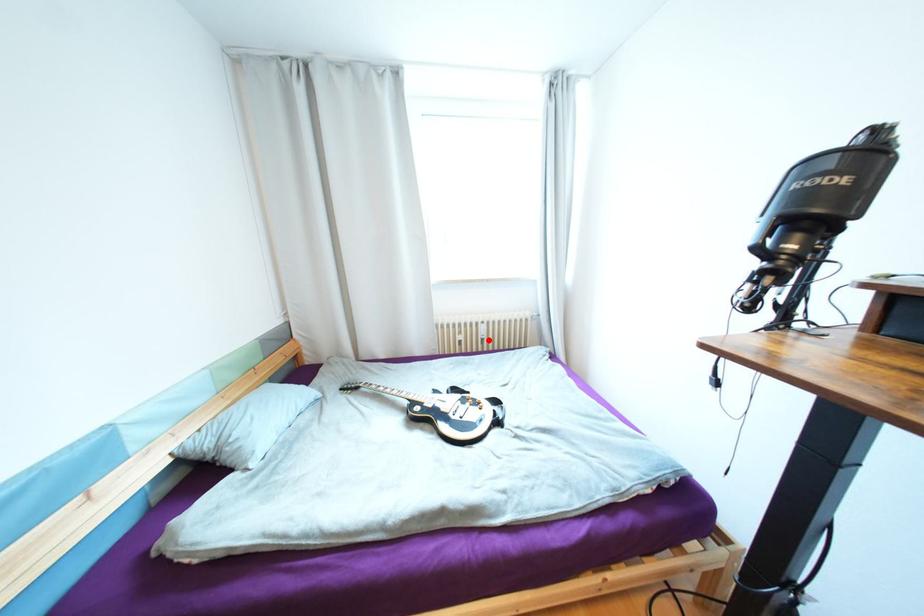
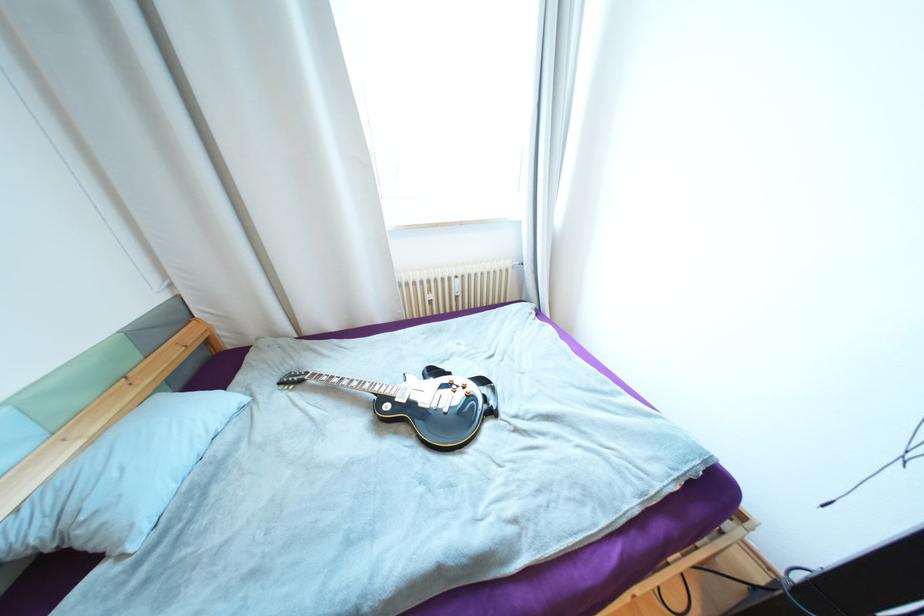
Where in the second image is the point corresponding to the highlighted location from the first image?

(463, 297)